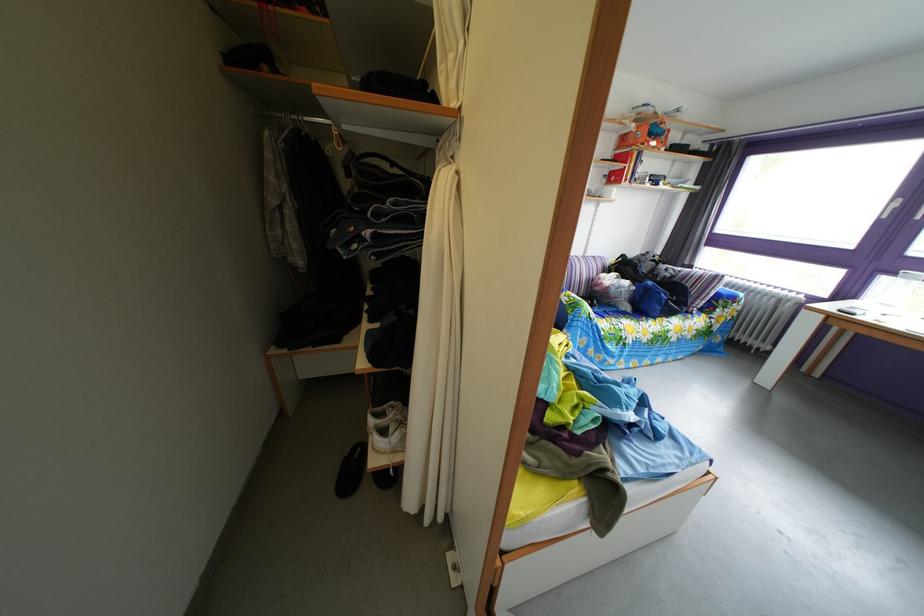
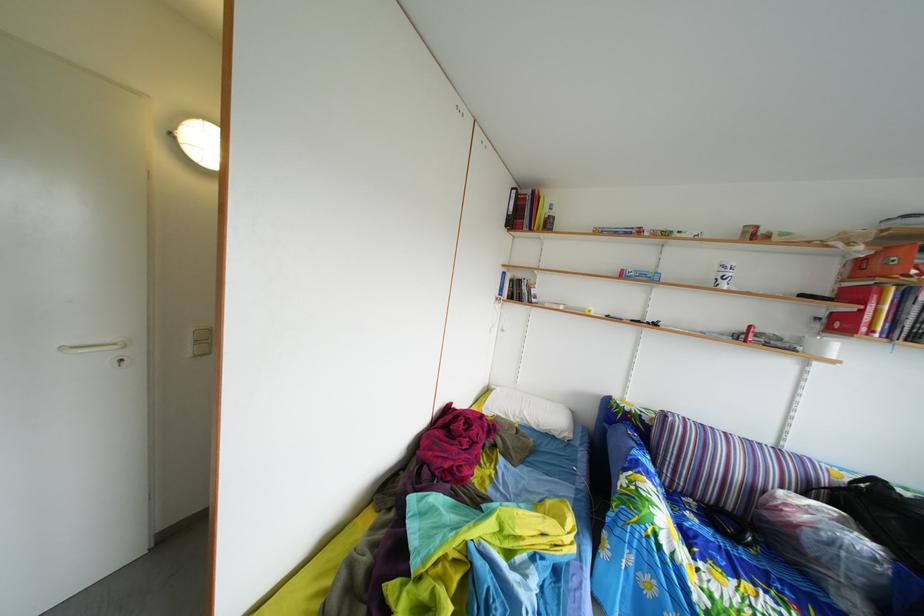
Question: I am providing you with two images of the same scene from different viewpoints. Which of the following objects are not visible in image2?

Choices:
 (A) black slipper
 (B) black bag
 (C) white pillow
 (D) green tissue box

Answer: (A)